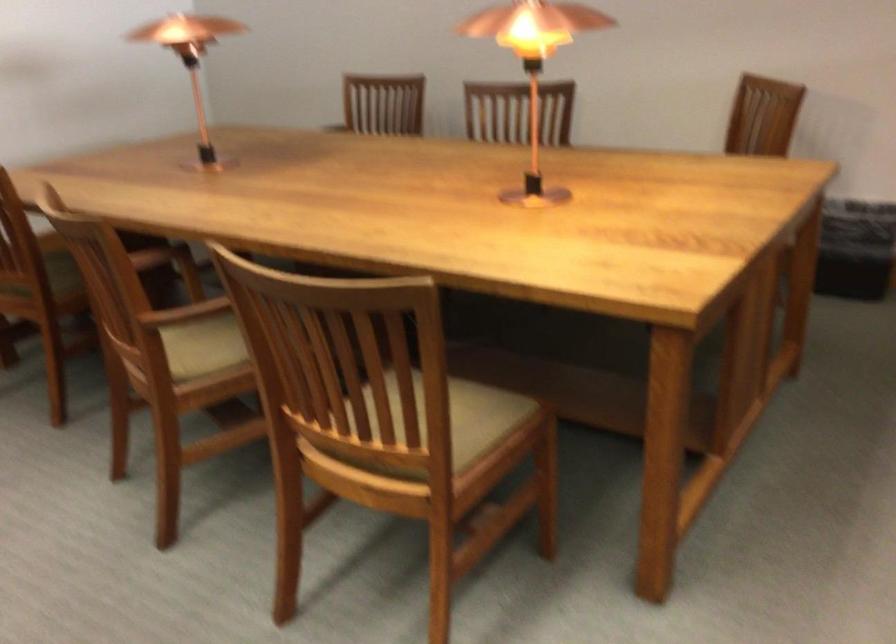
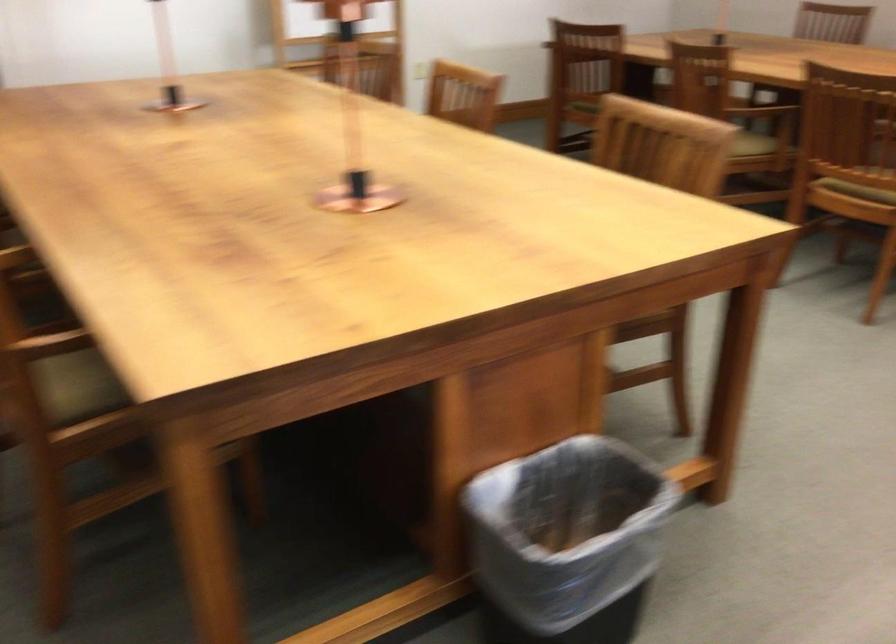
Question: Which direction would the cameraman need to move to produce the second image? Reply with the corresponding letter.

Choices:
 (A) Left
 (B) Right
 (C) Forward
 (D) Backward

Answer: (D)